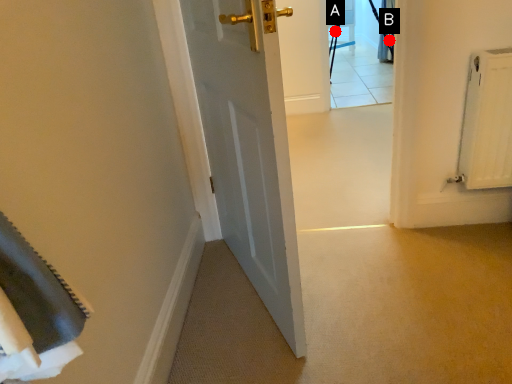
Question: Two points are circled on the image, labeled by A and B beside each circle. Which point appears closest to the camera in this image?

Choices:
 (A) A is closer
 (B) B is closer

Answer: (B)